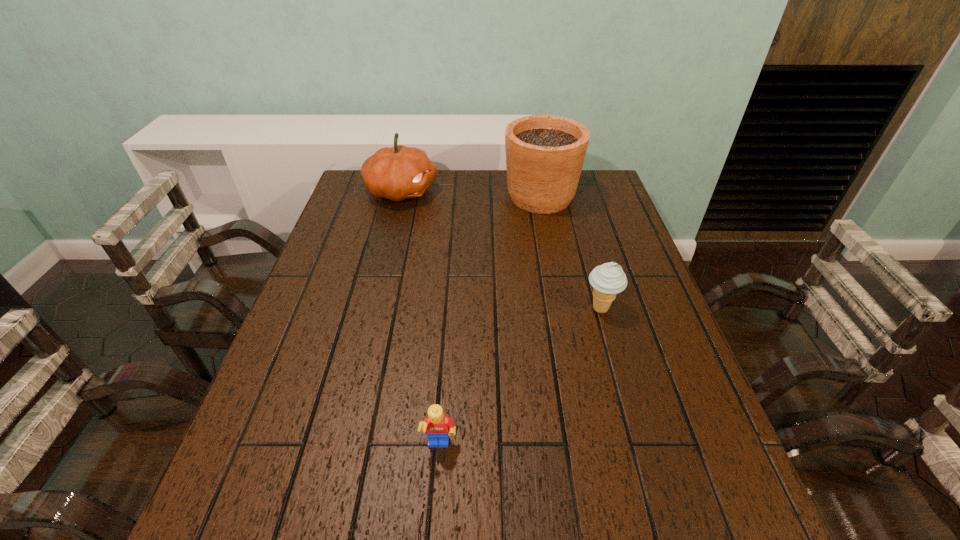
At what (x,y) coordinates should I click in order to perform the action: click on vacant space that satisfies the following two spatial constraints: 1. on the front face of the leftmost object; 2. on the right side of the third tallest object. Please return your answer as a coordinate pair (x, y). The height and width of the screenshot is (540, 960). Looking at the image, I should click on (372, 309).

You are a GUI agent. You are given a task and a screenshot of the screen. Output one action in this format:
    pyautogui.click(x=<x>, y=<y>)
    Task: Click on the vacant space that satisfies the following two spatial constraints: 1. on the back side of the flowerpot; 2. on the front face of the second tallest object
    Image resolution: width=960 pixels, height=540 pixels.
    Given the screenshot: What is the action you would take?
    pyautogui.click(x=540, y=191)

Locate an element on the screen. vacant space that satisfies the following two spatial constraints: 1. on the front side of the second shortest object; 2. on the left side of the flowerpot is located at coordinates (562, 309).

At what (x,y) coordinates should I click in order to perform the action: click on free space that satisfies the following two spatial constraints: 1. on the back side of the third farthest object; 2. on the front face of the third shortest object. Please return your answer as a coordinate pair (x, y). This screenshot has height=540, width=960. Looking at the image, I should click on (567, 191).